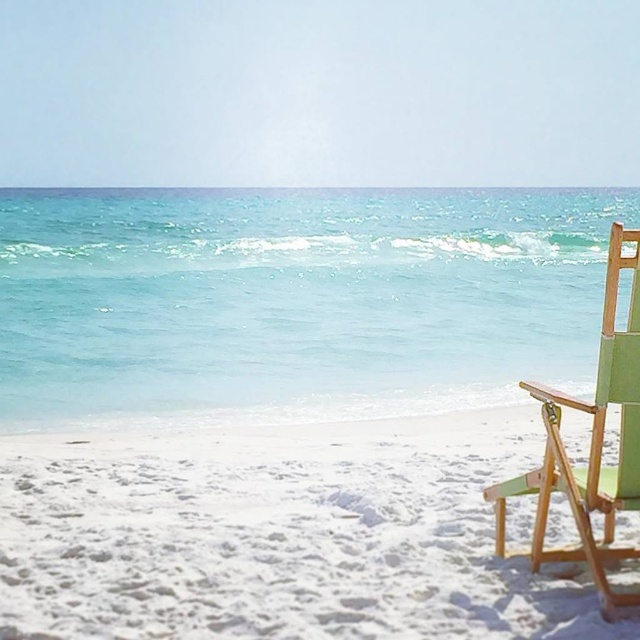
You are a person with a 60 centimeter wide beach umbrella that you want to set up between the white sandy beach at lower right and the green fabric chair at right. Can you place the umbrella between them without it touching either object?

The distance between the white sandy beach at lower right and the green fabric chair at right is 72.21 centimeters. Since the umbrella is 60 centimeters wide, there is enough space to place it between them without touching either object.

You are standing on the beach and want to place a 3.0 meter long fishing net between the white sandy beach at lower right and the wooden beach chair with green seat and backrest on the right. Can you fit the fishing net between them without it overlapping?

The white sandy beach at lower right is 2.94 meters from the viewer, so the distance between the white sandy beach at lower right and the wooden beach chair with green seat and backrest on the right is not provided. Therefore, it is impossible to determine if the 3.0 meter long fishing net can fit without overlapping.